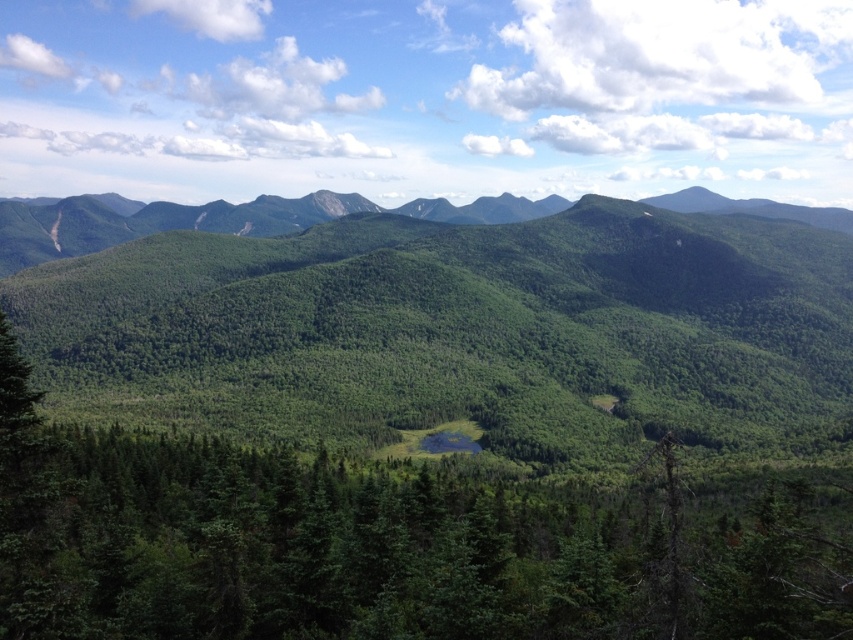
Question: Is green forested mountain range at center to the right of green forested mountain range at upper center from the viewer's perspective?

Choices:
 (A) yes
 (B) no

Answer: (A)

Question: Is green forested mountain range at center positioned before green matte tree at center?

Choices:
 (A) no
 (B) yes

Answer: (A)

Question: Which point appears closest to the camera in this image?

Choices:
 (A) (323, 209)
 (B) (793, 621)

Answer: (B)

Question: Does green forested mountain range at center appear under green matte tree at center?

Choices:
 (A) no
 (B) yes

Answer: (A)

Question: Which of the following is the closest to the observer?

Choices:
 (A) (653, 378)
 (B) (10, 234)

Answer: (A)

Question: Which point is closer to the camera?

Choices:
 (A) (514, 204)
 (B) (650, 333)

Answer: (B)